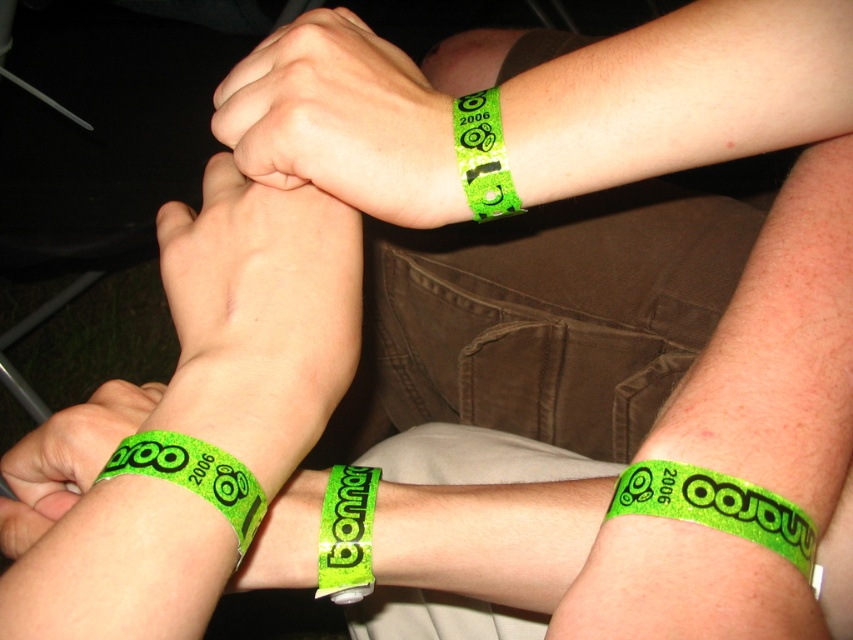
Measure the distance between green fluorescent wristband at center and camera.

green fluorescent wristband at center and camera are 29.45 centimeters apart from each other.

Is green fluorescent wristband at center positioned before green glittery wristband at upper center?

Yes, green fluorescent wristband at center is in front of green glittery wristband at upper center.

Between point (354, 166) and point (461, 161), which one is positioned in front?

Point (354, 166) is more forward.

Locate an element on the screen. Image resolution: width=853 pixels, height=640 pixels. green fluorescent wristband at center is located at coordinates (341, 122).

Which of these two, green glittery wristband at lower right or green glittery wristband at lower left, stands shorter?

With less height is green glittery wristband at lower right.

Looking at this image, which is more to the right, green glittery wristband at lower right or green glittery wristband at lower left?

Positioned to the right is green glittery wristband at lower right.

I want to click on green glittery wristband at lower right, so click(x=717, y=506).

Which is behind, point (44, 492) or point (379, 477)?

Point (44, 492)

How distant is green glitter wristband at lower left from green glittery wristband at lower center?

The distance of green glitter wristband at lower left from green glittery wristband at lower center is 3.91 inches.

Describe the element at coordinates (67, 458) in the screenshot. I see `green glitter wristband at lower left` at that location.

Identify the location of green glitter wristband at lower left. This screenshot has height=640, width=853. (x=67, y=458).